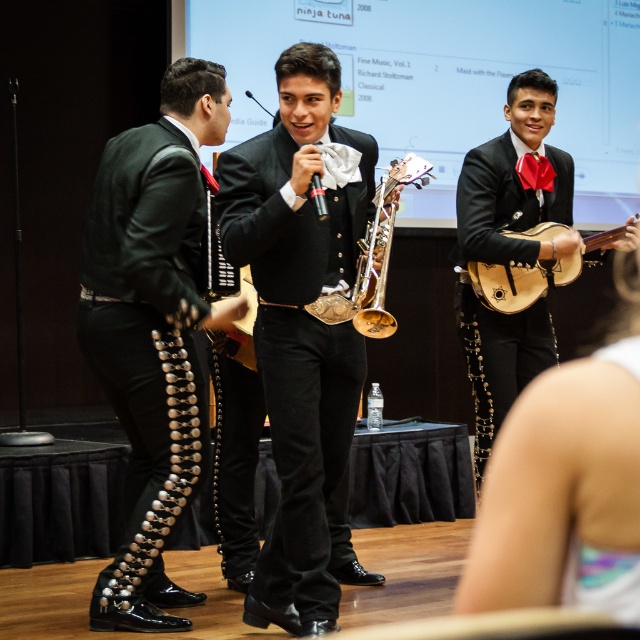
You are an event organizer setting up a stage for a mariachi performance. You need to place a decorative banner exactly at the coordinates where the green shiny vest at left is located. What are the coordinates where you should place the banner?

The green shiny vest at left is located at point [152,330], so you should place the banner at those coordinates.

Based on the scene description, can you determine which object, the green shiny vest at left or the wooden mandolin at right, is narrower in width?

The green shiny vest at left has a lesser width compared to the wooden mandolin at right, so the green shiny vest at left is narrower.